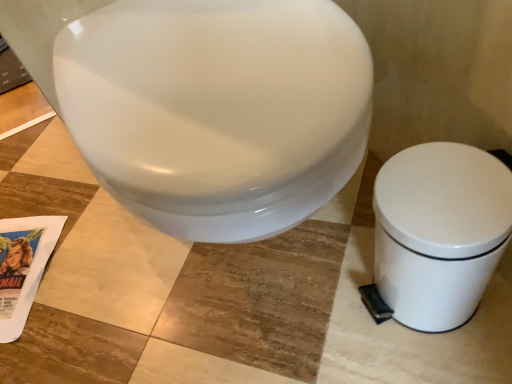
Identify the location of free space to the left of white glossy trash can at lower right. tap(311, 311).